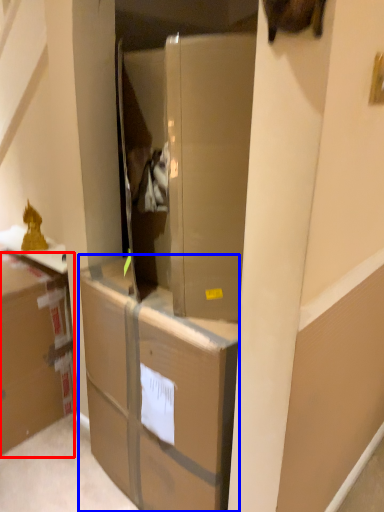
Question: Which object is further to the camera taking this photo, cardboard box (highlighted by a red box) or cabinetry (highlighted by a blue box)?

Choices:
 (A) cardboard box
 (B) cabinetry

Answer: (A)